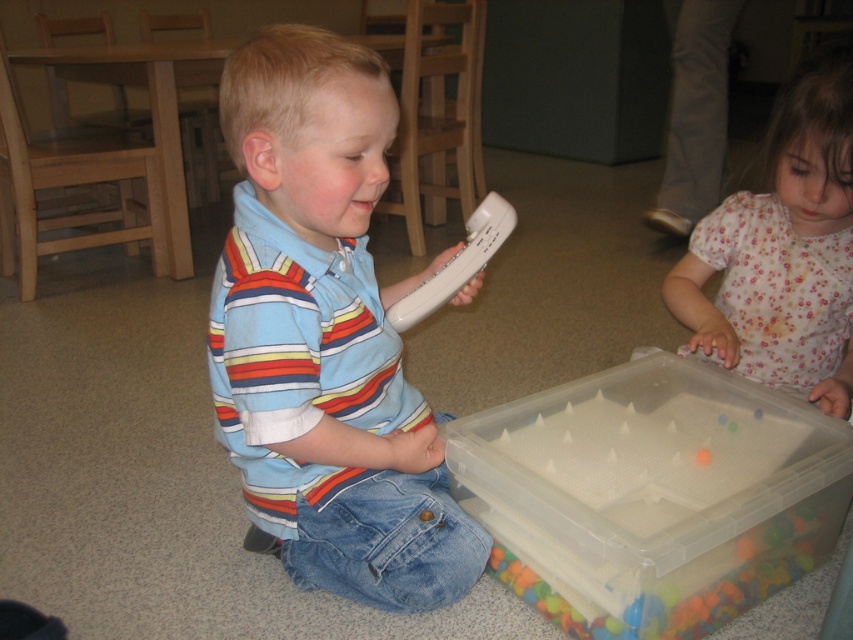
The scene shows a young boy and a girl in a classroom or playroom. The boy is wearing a light blue shirt with horizontal stripes in red, yellow, and white. The girl is wearing a light pink floral top. There is a point marked at coordinates (325, 336) in the image. What object or clothing item is located at that point?

The point at coordinates (325, 336) marks the matte striped shirt at center.

You are a teacher observing a classroom scene. You notice two children wearing different shirts. The first child has a matte striped shirt at center and the second has a floral cotton shirt at lower right. Which child is sitting closer to the left side of the classroom?

The matte striped shirt at center is positioned on the left side of the floral cotton shirt at lower right, so the child wearing the matte striped shirt at center is sitting closer to the left side of the classroom.